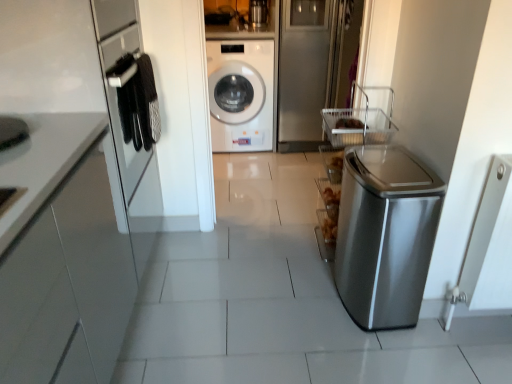
Question: Considering the relative positions of brushed metal washing machine at upper center and satin silver trash can at right in the image provided, is brushed metal washing machine at upper center to the right of satin silver trash can at right from the viewer's perspective?

Choices:
 (A) yes
 (B) no

Answer: (B)

Question: Can you confirm if brushed metal washing machine at upper center is smaller than satin silver trash can at right?

Choices:
 (A) no
 (B) yes

Answer: (B)

Question: Does brushed metal washing machine at upper center have a greater width compared to satin silver trash can at right?

Choices:
 (A) no
 (B) yes

Answer: (A)

Question: Is brushed metal washing machine at upper center shorter than satin silver trash can at right?

Choices:
 (A) yes
 (B) no

Answer: (A)

Question: Is brushed metal washing machine at upper center located outside satin silver trash can at right?

Choices:
 (A) yes
 (B) no

Answer: (A)

Question: From a real-world perspective, is brushed metal washing machine at upper center physically below satin silver trash can at right?

Choices:
 (A) yes
 (B) no

Answer: (B)

Question: From the image's perspective, is satin silver trash can at right located beneath white glossy washing machine at center?

Choices:
 (A) yes
 (B) no

Answer: (A)

Question: Considering the relative positions of satin silver trash can at right and white glossy washing machine at center in the image provided, is satin silver trash can at right behind white glossy washing machine at center?

Choices:
 (A) yes
 (B) no

Answer: (B)

Question: From the image's perspective, is satin silver trash can at right above white glossy washing machine at center?

Choices:
 (A) no
 (B) yes

Answer: (A)

Question: Are satin silver trash can at right and white glossy washing machine at center located far from each other?

Choices:
 (A) no
 (B) yes

Answer: (B)

Question: Is satin silver trash can at right aimed at white glossy washing machine at center?

Choices:
 (A) no
 (B) yes

Answer: (A)

Question: Does satin silver trash can at right appear on the left side of white glossy washing machine at center?

Choices:
 (A) no
 (B) yes

Answer: (A)

Question: From the image's perspective, is white glossy washing machine at center above brushed metal washing machine at upper center?

Choices:
 (A) no
 (B) yes

Answer: (A)